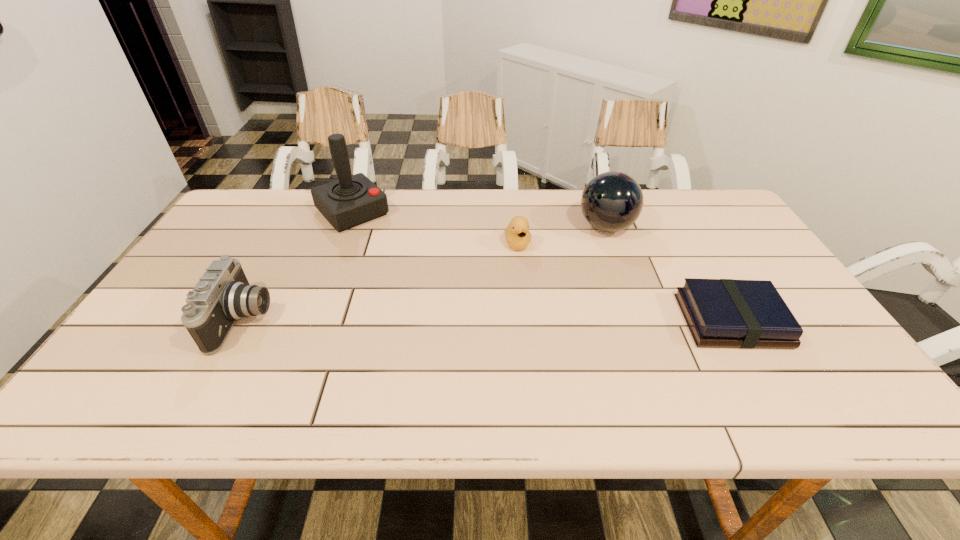
Identify the location of vacant spot on the desktop that is between the camera and the book and is positioned on the face of the duckling. This screenshot has width=960, height=540. (540, 320).

Identify the location of free space on the desktop that is between the third tallest object and the book and is positioned on the side of the bowling ball with the finger holes. This screenshot has height=540, width=960. (450, 320).

Locate an element on the screen. This screenshot has height=540, width=960. free space on the desktop that is between the third shortest object and the rightmost object and is positioned on the base of the tallest object is located at coordinates (457, 320).